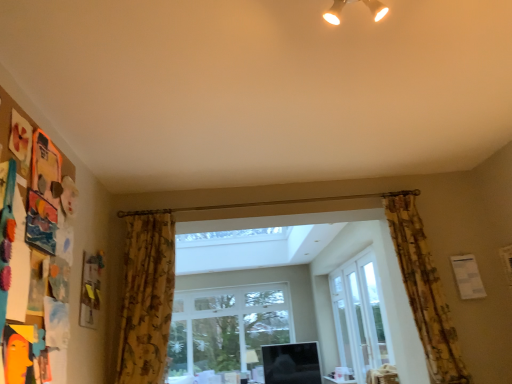
Question: Considering the relative sizes of white glass door at center, acting as the 2th window starting from the left, and floral fabric curtain at right, the 2th curtain from the left, in the image provided, is white glass door at center, acting as the 2th window starting from the left, shorter than floral fabric curtain at right, the 2th curtain from the left,?

Choices:
 (A) yes
 (B) no

Answer: (A)

Question: Does white glass door at center, acting as the 2th window starting from the left, have a greater width compared to floral fabric curtain at right, the 2th curtain from the left?

Choices:
 (A) yes
 (B) no

Answer: (B)

Question: Is white glass door at center, the 2th window when ordered from back to front, surrounding floral fabric curtain at right, marked as the 1th curtain in a right-to-left arrangement?

Choices:
 (A) no
 (B) yes

Answer: (A)

Question: Is white glass door at center, acting as the 2th window starting from the left, at the right side of floral fabric curtain at right, marked as the 1th curtain in a right-to-left arrangement?

Choices:
 (A) no
 (B) yes

Answer: (B)

Question: Is white glass door at center, arranged as the first window when viewed from the front, smaller than floral fabric curtain at right, the 2th curtain from the left?

Choices:
 (A) yes
 (B) no

Answer: (A)

Question: Is point (373, 9) closer or farther from the camera than point (210, 367)?

Choices:
 (A) closer
 (B) farther

Answer: (A)

Question: Based on their sizes in the image, would you say white glossy spotlights at upper center is bigger or smaller than clear glass window at center, the first window from the left?

Choices:
 (A) small
 (B) big

Answer: (A)

Question: From their relative heights in the image, would you say white glossy spotlights at upper center is taller or shorter than clear glass window at center, the first window from the left?

Choices:
 (A) tall
 (B) short

Answer: (B)

Question: In terms of width, does white glossy spotlights at upper center look wider or thinner when compared to clear glass window at center, arranged as the 2th window when viewed from the right?

Choices:
 (A) wide
 (B) thin

Answer: (A)

Question: Is point coord(157,344) positioned closer to the camera than point coord(336,336)?

Choices:
 (A) closer
 (B) farther

Answer: (A)

Question: Is floral fabric curtain at left, which ranks as the first curtain in left-to-right order, bigger or smaller than white glass screen door at center?

Choices:
 (A) small
 (B) big

Answer: (B)

Question: Choose the correct answer: Is floral fabric curtain at left, which ranks as the first curtain in left-to-right order, inside white glass screen door at center or outside it?

Choices:
 (A) inside
 (B) outside

Answer: (B)

Question: From the image's perspective, is floral fabric curtain at left, which ranks as the first curtain in left-to-right order, above or below white glass screen door at center?

Choices:
 (A) below
 (B) above

Answer: (B)

Question: From the image's perspective, is floral fabric curtain at right, marked as the 1th curtain in a right-to-left arrangement, positioned above or below clear glass window at center, arranged as the 2th window when viewed from the right?

Choices:
 (A) below
 (B) above

Answer: (B)

Question: Is floral fabric curtain at right, marked as the 1th curtain in a right-to-left arrangement, wider or thinner than clear glass window at center, arranged as the 2th window when viewed from the right?

Choices:
 (A) thin
 (B) wide

Answer: (B)